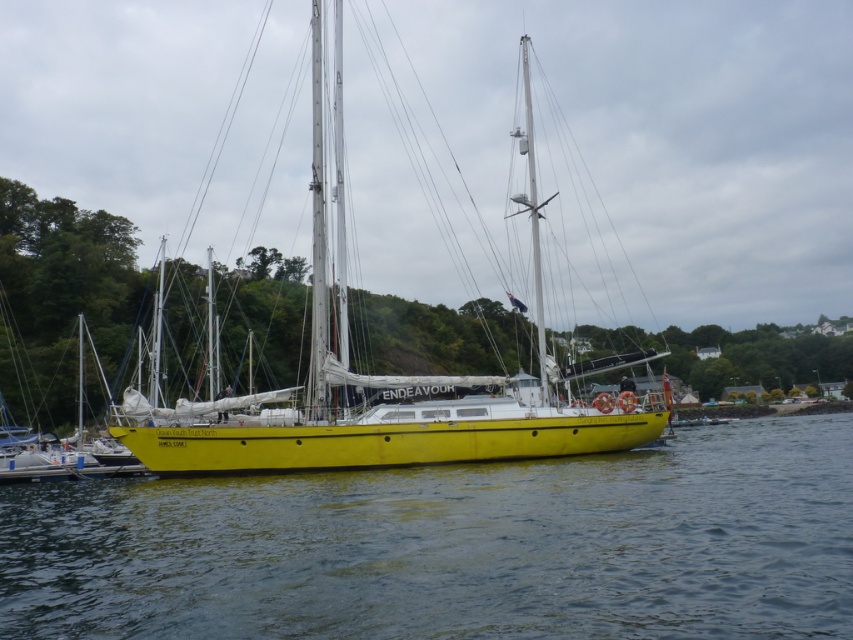
Can you confirm if yellow matte water at center is taller than yellow matte sailboat at center?

Incorrect, yellow matte water at center's height is not larger of yellow matte sailboat at center's.

Can you confirm if yellow matte water at center is positioned to the right of yellow matte sailboat at center?

Correct, you'll find yellow matte water at center to the right of yellow matte sailboat at center.

At what (x,y) coordinates should I click in order to perform the action: click on yellow matte water at center. Please return your answer as a coordinate pair (x, y). The width and height of the screenshot is (853, 640). Looking at the image, I should click on (454, 547).